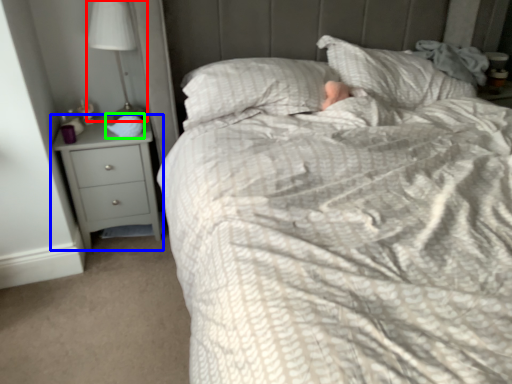
Question: Estimate the real-world distances between objects in this image. Which object is closer to lamp (highlighted by a red box), chest of drawers (highlighted by a blue box) or sleeping bag (highlighted by a green box)?

Choices:
 (A) chest of drawers
 (B) sleeping bag

Answer: (B)